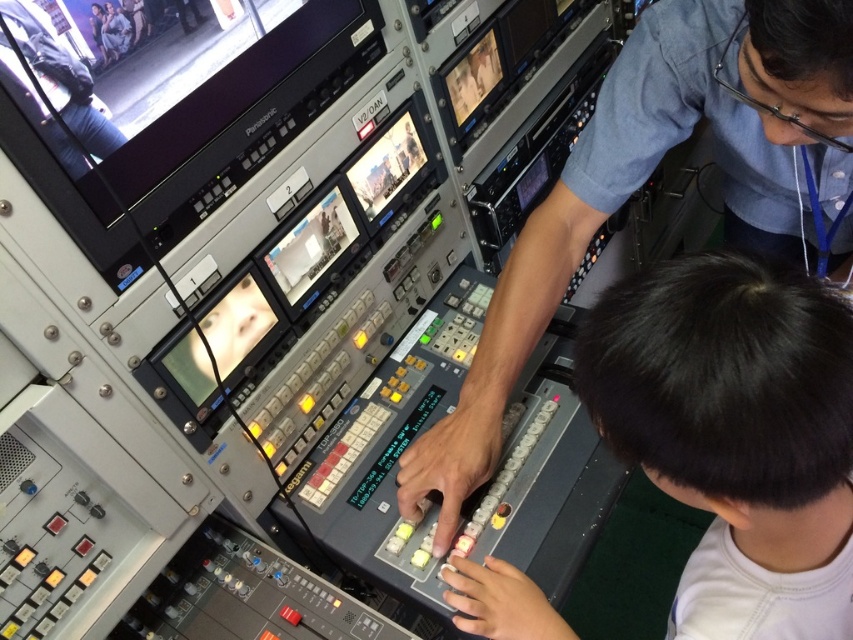
Question: Does metallic gray control panel at center appear under matte black pants at upper left?

Choices:
 (A) yes
 (B) no

Answer: (A)

Question: Can you confirm if metallic gray control panel at center is positioned to the right of matte black pants at upper left?

Choices:
 (A) no
 (B) yes

Answer: (B)

Question: Which point appears farthest from the camera in this image?

Choices:
 (A) (102, 136)
 (B) (577, 225)
 (C) (717, 456)

Answer: (B)

Question: Which of the following is the farthest from the observer?

Choices:
 (A) (708, 483)
 (B) (550, 298)
 (C) (103, 113)

Answer: (B)

Question: Can you confirm if dark hair at center is wider than metallic gray control panel at center?

Choices:
 (A) no
 (B) yes

Answer: (A)

Question: Which point is farther to the camera?

Choices:
 (A) (747, 52)
 (B) (804, 572)

Answer: (A)